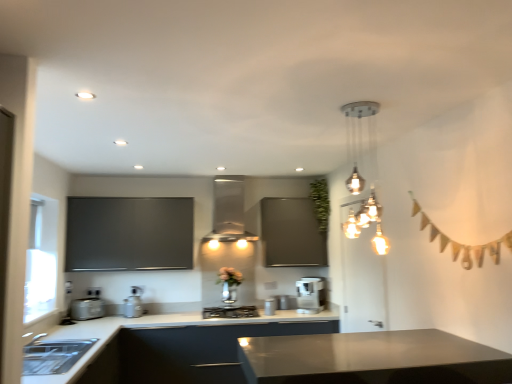
Question: Should I look upward or downward to see satin silver toaster at lower left, which ranks as the 1th appliance in left-to-right order?

Choices:
 (A) down
 (B) up

Answer: (A)

Question: Is white plastic electric outlet at lower left outside black matte gas stove at center?

Choices:
 (A) no
 (B) yes

Answer: (B)

Question: Considering the relative positions of white plastic electric outlet at lower left and black matte gas stove at center in the image provided, is white plastic electric outlet at lower left to the left of black matte gas stove at center from the viewer's perspective?

Choices:
 (A) yes
 (B) no

Answer: (A)

Question: Is white plastic electric outlet at lower left facing away from black matte gas stove at center?

Choices:
 (A) no
 (B) yes

Answer: (A)

Question: Is white plastic electric outlet at lower left further to camera compared to black matte gas stove at center?

Choices:
 (A) no
 (B) yes

Answer: (B)

Question: Is white plastic electric outlet at lower left positioned far away from black matte gas stove at center?

Choices:
 (A) no
 (B) yes

Answer: (B)

Question: Considering the relative sizes of white plastic electric outlet at lower left and black matte gas stove at center in the image provided, is white plastic electric outlet at lower left bigger than black matte gas stove at center?

Choices:
 (A) yes
 (B) no

Answer: (B)

Question: From the image's perspective, is white plastic electric outlet at lower left beneath satin black cabinet at lower left?

Choices:
 (A) no
 (B) yes

Answer: (A)

Question: Can you confirm if white plastic electric outlet at lower left is smaller than satin black cabinet at lower left?

Choices:
 (A) yes
 (B) no

Answer: (A)

Question: Considering the relative sizes of white plastic electric outlet at lower left and satin black cabinet at lower left in the image provided, is white plastic electric outlet at lower left wider than satin black cabinet at lower left?

Choices:
 (A) yes
 (B) no

Answer: (B)

Question: Is white plastic electric outlet at lower left to the right of satin black cabinet at lower left from the viewer's perspective?

Choices:
 (A) no
 (B) yes

Answer: (A)

Question: Considering the relative sizes of white plastic electric outlet at lower left and satin black cabinet at lower left in the image provided, is white plastic electric outlet at lower left bigger than satin black cabinet at lower left?

Choices:
 (A) yes
 (B) no

Answer: (B)

Question: From the image's perspective, would you say white plastic electric outlet at lower left is positioned over satin black cabinet at lower left?

Choices:
 (A) no
 (B) yes

Answer: (B)

Question: Is green leafy plant at upper center bigger than satin black cabinet at lower left?

Choices:
 (A) no
 (B) yes

Answer: (A)